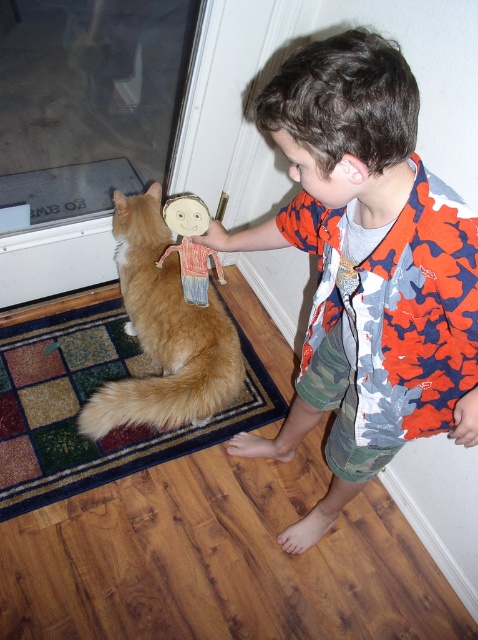
You are a robot trying to navigate to the cat. The cat is at point (32, 10). You are at point (451, 280). Which direction should you move to get closer to the cat?

The point (451, 280) is closer to the viewer than point (32, 10). To move towards the cat at point (32, 10), you should move away from the viewer since the cat is further away from the current position.